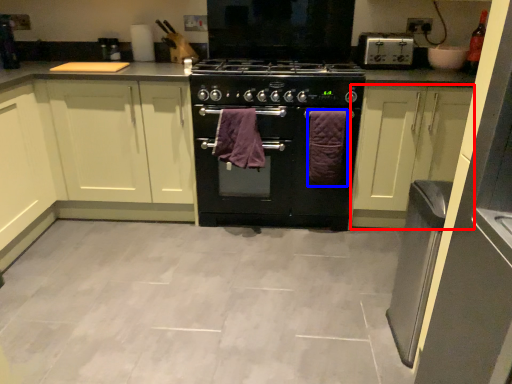
Question: Among these objects, which one is farthest to the camera, cabinetry (highlighted by a red box) or bath towel (highlighted by a blue box)?

Choices:
 (A) cabinetry
 (B) bath towel

Answer: (B)